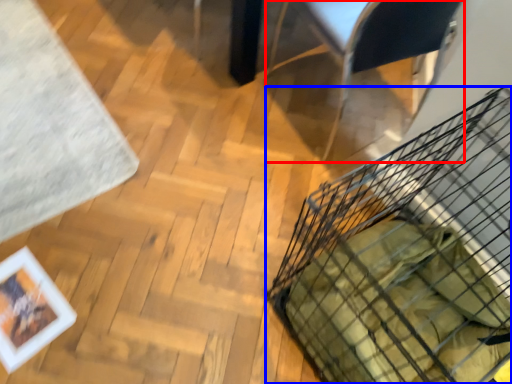
Question: Among these objects, which one is nearest to the camera, armchair (highlighted by a red box) or basket (highlighted by a blue box)?

Choices:
 (A) armchair
 (B) basket

Answer: (B)